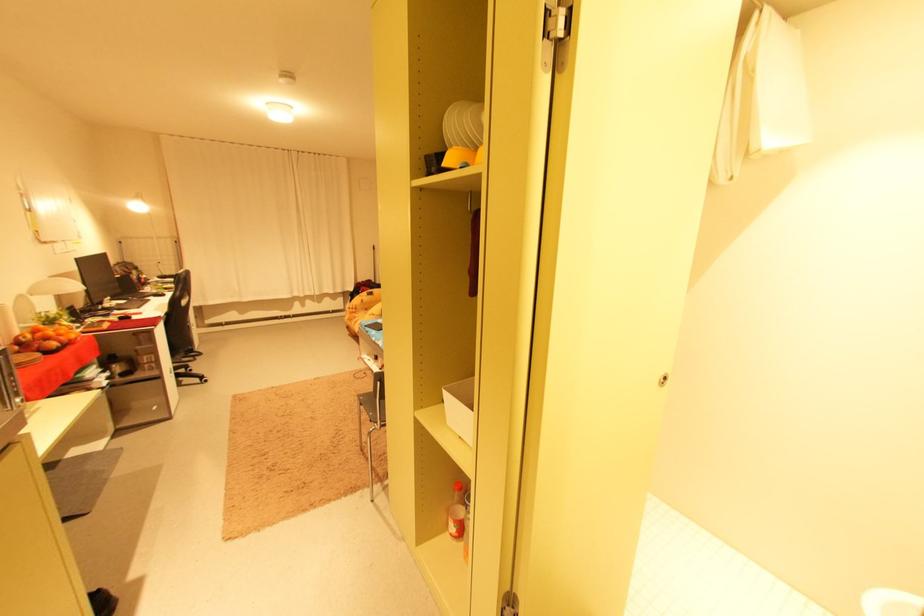
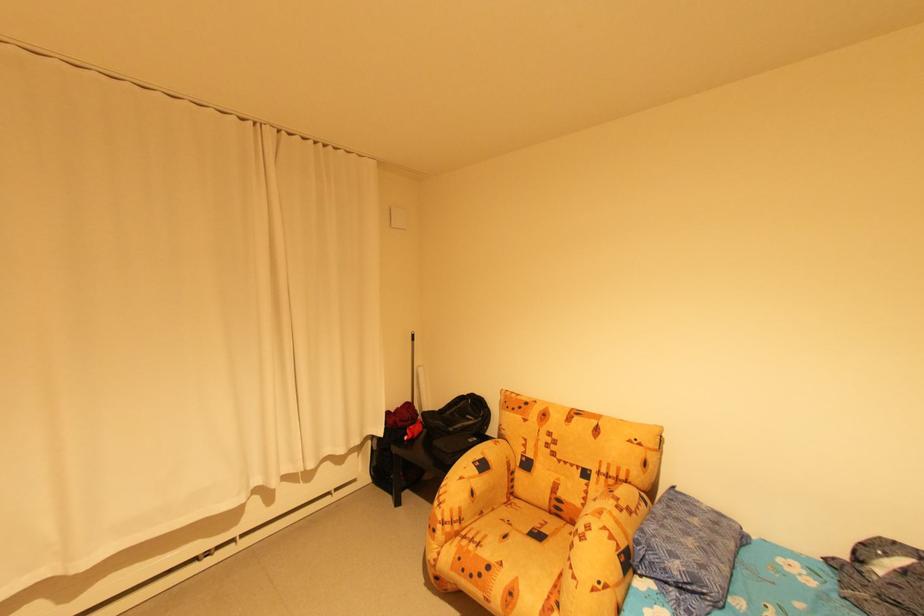
In the second image, find the point that corresponds to the point at 358,310 in the first image.

(456, 529)